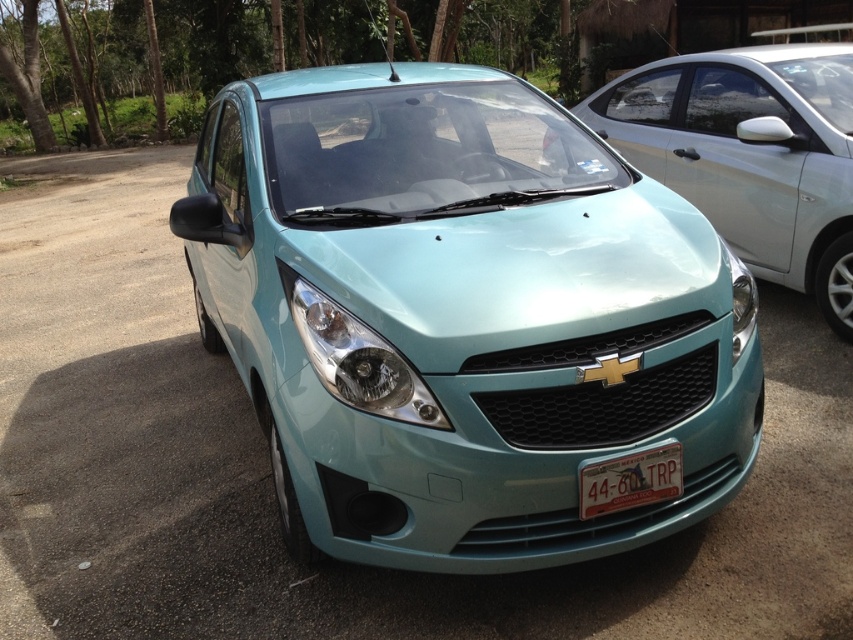
Can you confirm if teal glossy car at center is positioned below satin teal headlight at center?

No.

Who is more distant from viewer, (323, 166) or (393, 353)?

Positioned behind is point (323, 166).

Find the location of `teal glossy car at center`. teal glossy car at center is located at coordinates (457, 316).

Find the location of a particular element. teal glossy car at center is located at coordinates (457, 316).

Does teal glossy car at center lie in front of satin teal headlight at center-right?

That is True.

Is teal glossy car at center shorter than satin teal headlight at center-right?

No, teal glossy car at center is not shorter than satin teal headlight at center-right.

Between point (366, 458) and point (735, 317), which one is positioned in front?

Positioned in front is point (366, 458).

Locate an element on the screen. This screenshot has height=640, width=853. teal glossy car at center is located at coordinates (457, 316).

Between point (723, 371) and point (631, 499), which one is positioned behind?

Positioned behind is point (723, 371).

Between teal glossy car at center and white plastic license plate at center, which one appears on the right side from the viewer's perspective?

white plastic license plate at center is more to the right.

Where is `teal glossy car at center`? teal glossy car at center is located at coordinates (457, 316).